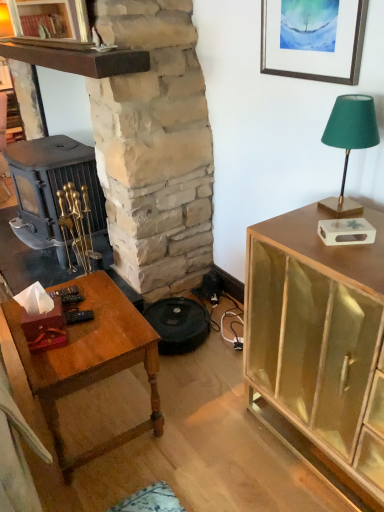
This screenshot has width=384, height=512. I want to click on free spot above wooden table at lower left (from a real-world perspective), so click(81, 321).